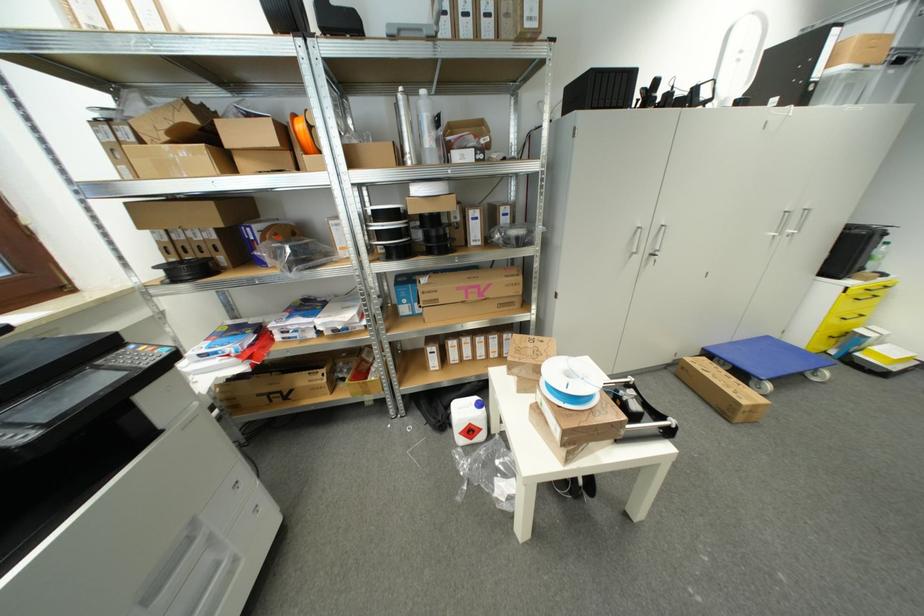
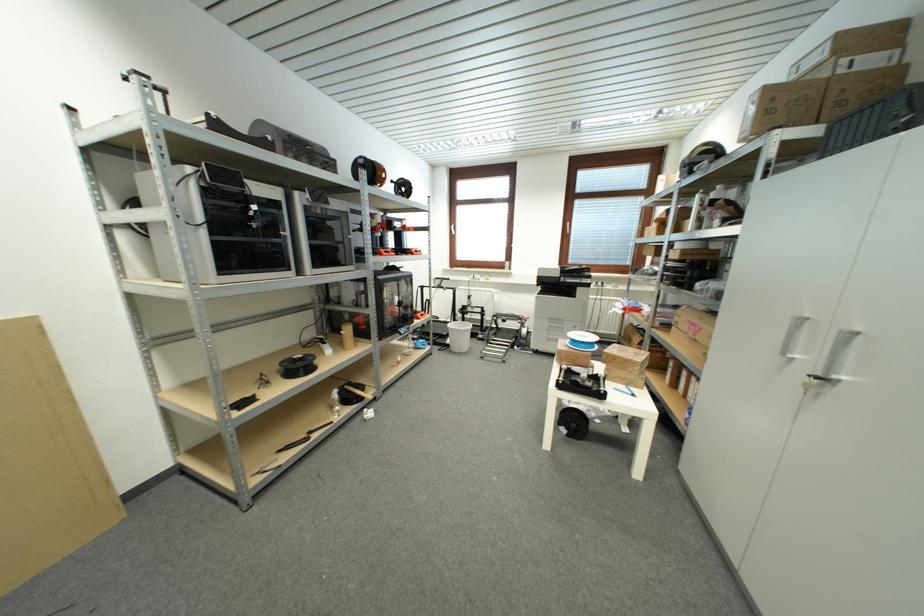
In the second image, find the point that corresponds to pixel 478 300 in the first image.

(696, 334)